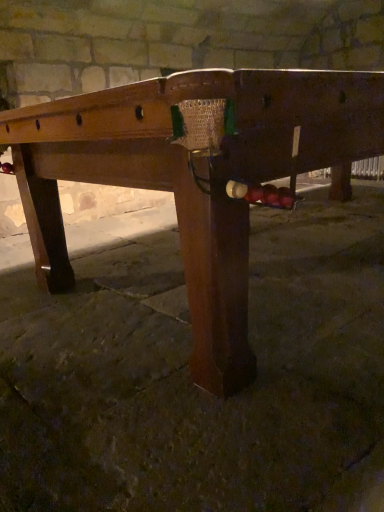
What are the coordinates of `wooden pool table at center` in the screenshot? It's located at (194, 174).

What do you see at coordinates (194, 174) in the screenshot? I see `wooden pool table at center` at bounding box center [194, 174].

You are a GUI agent. You are given a task and a screenshot of the screen. Output one action in this format:
    pyautogui.click(x=<x>, y=<y>)
    Task: Click on the wooden pool table at center
    Image resolution: width=384 pixels, height=512 pixels.
    Given the screenshot: What is the action you would take?
    pyautogui.click(x=194, y=174)